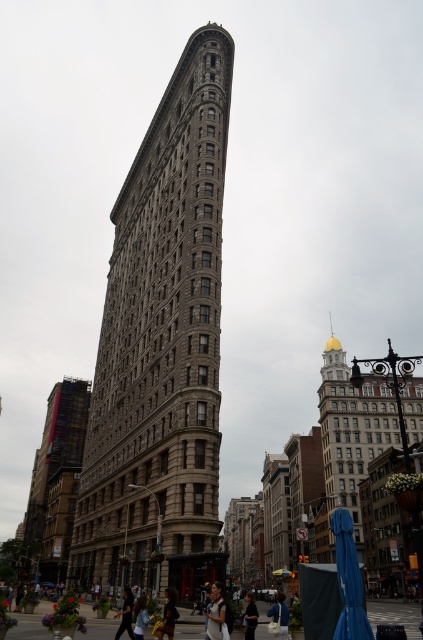
Question: Is the position of dark brown leather jacket at center less distant than that of dark blue jeans at lower center?

Choices:
 (A) no
 (B) yes

Answer: (B)

Question: Estimate the real-world distances between objects in this image. Which object is closer to the matte black jacket at lower center?

Choices:
 (A) dark blue jeans at lower center
 (B) light brown leather jacket at lower center
 (C) dark blue jeans at center

Answer: (A)

Question: Is brown stone building at center positioned at the back of light brown leather jacket at lower center?

Choices:
 (A) yes
 (B) no

Answer: (A)

Question: Estimate the real-world distances between objects in this image. Which object is closer to the dark brown leather jacket at center?

Choices:
 (A) dark blue jeans at lower center
 (B) light brown leather jacket at lower center

Answer: (A)

Question: Which object appears farthest from the camera in this image?

Choices:
 (A) dark blue jeans at lower center
 (B) gold dome building at right

Answer: (B)

Question: Is gold dome building at right thinner than matte black jacket at lower center?

Choices:
 (A) no
 (B) yes

Answer: (A)